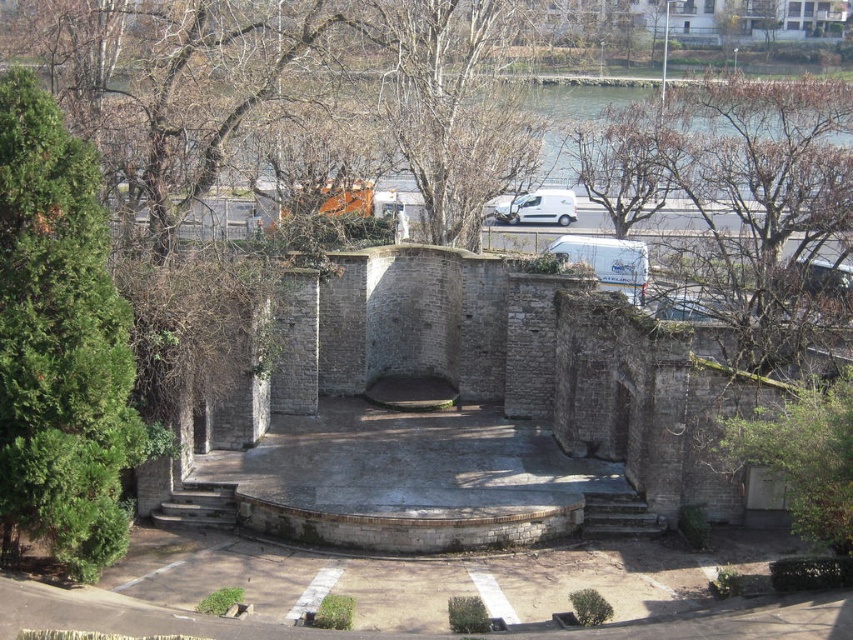
You are standing at the amphitheater stage and want to walk towards the road with vehicles. Which point, point (x=682, y=360) or point (x=550, y=211), is closer to you as you face the road?

Point (x=682, y=360) is closer to the viewer than point (x=550, y=211), so you should head towards point (x=682, y=360) as it is nearer to your current position at the amphitheater stage facing the road.